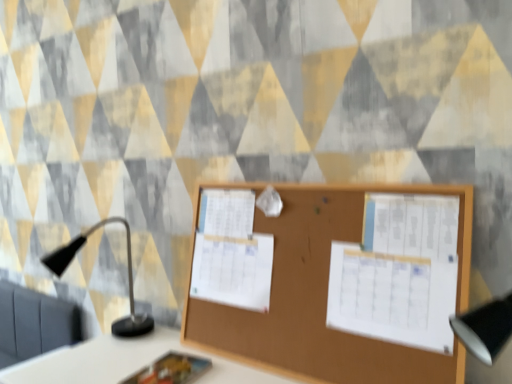
Question: From the image's perspective, does brown wood bulletin board at center appear lower than white paper at center, the second poster viewed from the right?

Choices:
 (A) no
 (B) yes

Answer: (A)

Question: Does brown wood bulletin board at center lie behind white paper at center, the 1th poster viewed from the left?

Choices:
 (A) no
 (B) yes

Answer: (A)

Question: Would you say brown wood bulletin board at center contains white paper at center, placed as the first poster when sorted from back to front?

Choices:
 (A) no
 (B) yes

Answer: (B)

Question: Can you confirm if brown wood bulletin board at center is shorter than white paper at center, placed as the first poster when sorted from back to front?

Choices:
 (A) no
 (B) yes

Answer: (A)

Question: Is brown wood bulletin board at center located outside white paper at center, the second poster viewed from the right?

Choices:
 (A) no
 (B) yes

Answer: (B)

Question: From a real-world perspective, is brown wood bulletin board at center over white paper at center, the 1th poster viewed from the left?

Choices:
 (A) yes
 (B) no

Answer: (A)

Question: Is the surface of black matte table lamp at left in direct contact with matte plastic notebook at lower center?

Choices:
 (A) no
 (B) yes

Answer: (A)

Question: Can matte plastic notebook at lower center be found inside black matte table lamp at left?

Choices:
 (A) no
 (B) yes

Answer: (A)

Question: From a real-world perspective, is black matte table lamp at left physically below matte plastic notebook at lower center?

Choices:
 (A) yes
 (B) no

Answer: (B)

Question: Is black matte table lamp at left closer to camera compared to matte plastic notebook at lower center?

Choices:
 (A) yes
 (B) no

Answer: (B)

Question: Considering the relative positions of black matte table lamp at left and matte plastic notebook at lower center in the image provided, is black matte table lamp at left behind matte plastic notebook at lower center?

Choices:
 (A) yes
 (B) no

Answer: (A)

Question: Is black matte table lamp at left facing towards matte plastic notebook at lower center?

Choices:
 (A) no
 (B) yes

Answer: (A)

Question: Is white paper at center, placed as the first poster when sorted from back to front, in front of matte plastic notebook at lower center?

Choices:
 (A) no
 (B) yes

Answer: (A)